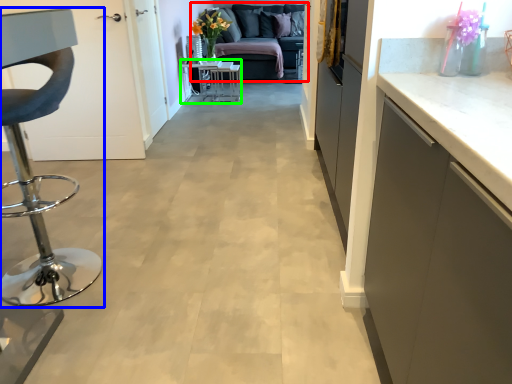
Question: Which object is the farthest from studio couch (highlighted by a red box)? Choose among these: furniture (highlighted by a blue box) or table (highlighted by a green box).

Choices:
 (A) furniture
 (B) table

Answer: (A)